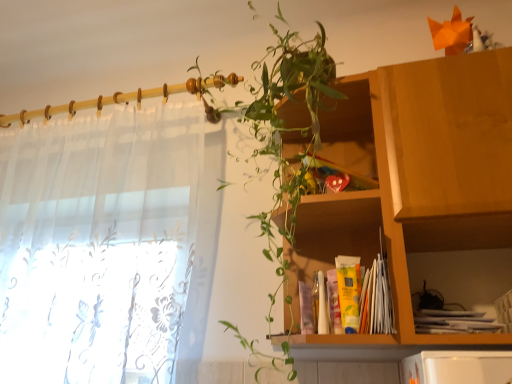
Question: Is green leafy plant at upper center far away from wooden cabinet at upper right?

Choices:
 (A) no
 (B) yes

Answer: (A)

Question: Is wooden cabinet at upper right at the back of green leafy plant at upper center?

Choices:
 (A) yes
 (B) no

Answer: (B)

Question: Is green leafy plant at upper center wider than wooden cabinet at upper right?

Choices:
 (A) yes
 (B) no

Answer: (A)

Question: Is green leafy plant at upper center positioned in front of wooden cabinet at upper right?

Choices:
 (A) no
 (B) yes

Answer: (B)

Question: Is green leafy plant at upper center bigger than wooden cabinet at upper right?

Choices:
 (A) yes
 (B) no

Answer: (A)

Question: From the image's perspective, would you say green leafy plant at upper center is positioned over wooden cabinet at upper right?

Choices:
 (A) no
 (B) yes

Answer: (B)

Question: Is sheer white curtain at left bigger than green leafy plant at upper center?

Choices:
 (A) no
 (B) yes

Answer: (B)

Question: Is the position of sheer white curtain at left more distant than that of green leafy plant at upper center?

Choices:
 (A) yes
 (B) no

Answer: (A)

Question: Is sheer white curtain at left to the right of green leafy plant at upper center from the viewer's perspective?

Choices:
 (A) no
 (B) yes

Answer: (A)

Question: Is sheer white curtain at left not within green leafy plant at upper center?

Choices:
 (A) yes
 (B) no

Answer: (A)

Question: Can you confirm if sheer white curtain at left is smaller than green leafy plant at upper center?

Choices:
 (A) yes
 (B) no

Answer: (B)

Question: Is sheer white curtain at left aimed at green leafy plant at upper center?

Choices:
 (A) yes
 (B) no

Answer: (B)

Question: Does green leafy plant at upper center have a greater width compared to sheer white curtain at left?

Choices:
 (A) no
 (B) yes

Answer: (B)